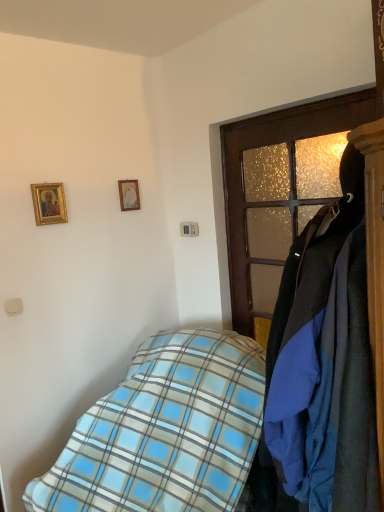
Question: In the image, is blue plaid blanket at lower left, the second bed viewed from the back, on the left side or the right side of blue plaid blanket at lower left, which is counted as the first bed, starting from the back?

Choices:
 (A) right
 (B) left

Answer: (A)

Question: In the image, is blue plaid blanket at lower left, the second bed viewed from the back, positioned in front of or behind blue plaid blanket at lower left, which is counted as the first bed, starting from the back?

Choices:
 (A) behind
 (B) front

Answer: (B)

Question: Which of these objects is positioned closest to the wooden door at right?

Choices:
 (A) blue plaid blanket at lower left, which is counted as the first bed, starting from the back
 (B) gold-framed painting at upper left, which is the 1th picture frame in front-to-back order
 (C) wooden picture frame at upper center, the second picture frame when ordered from front to back
 (D) blue plaid blanket at lower left, the 1th bed viewed from the front

Answer: (A)

Question: Based on their relative distances, which object is nearer to the gold-framed painting at upper left, acting as the second picture frame starting from the back?

Choices:
 (A) blue plaid blanket at lower left, the second bed viewed from the back
 (B) blue plaid blanket at lower left, which is counted as the first bed, starting from the back
 (C) wooden door at right
 (D) wooden picture frame at upper center, which is the first picture frame in back-to-front order

Answer: (D)